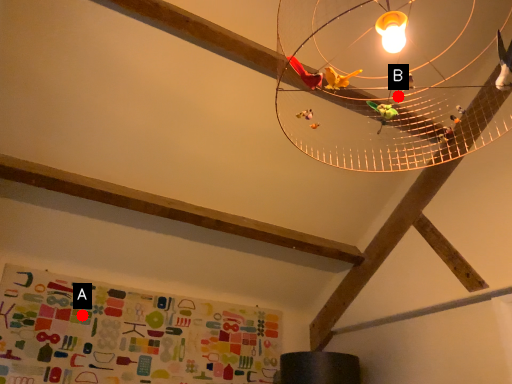
Question: Two points are circled on the image, labeled by A and B beside each circle. Which point is farther to the camera?

Choices:
 (A) A is further
 (B) B is further

Answer: (A)